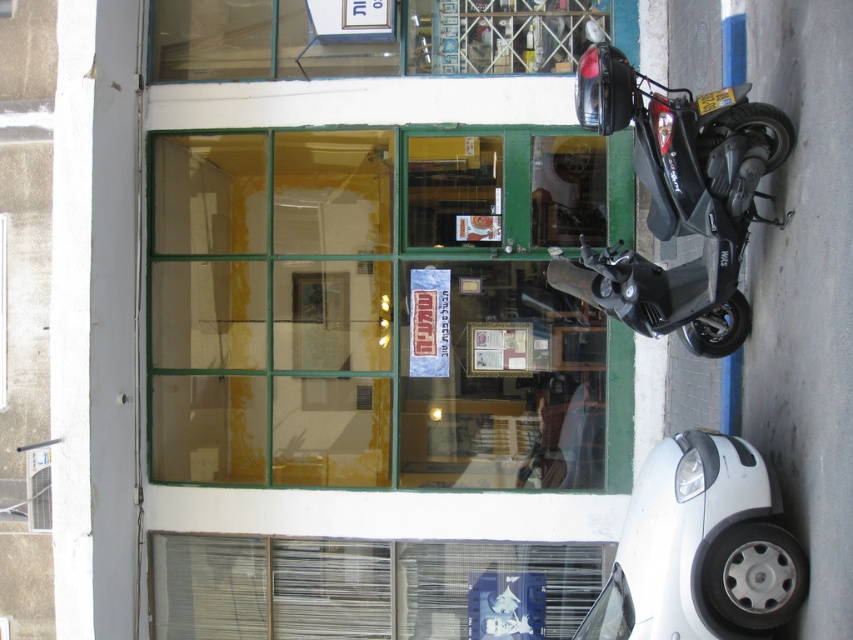
Can you confirm if matte black scooter at right is smaller than transparent glass window at upper center?

No, matte black scooter at right is not smaller than transparent glass window at upper center.

Is matte black scooter at right bigger than transparent glass window at upper center?

Yes.

Find the location of `matte black scooter at right`. matte black scooter at right is located at coordinates (677, 202).

Image resolution: width=853 pixels, height=640 pixels. I want to click on matte black scooter at right, so click(x=677, y=202).

Is point (669, 566) in front of point (198, 44)?

Yes, point (669, 566) is closer to viewer.

Does point (647, 518) come behind point (523, 4)?

That is False.

What do you see at coordinates (700, 548) in the screenshot? The image size is (853, 640). I see `white matte car at lower right` at bounding box center [700, 548].

Identify the location of white matte car at lower right. Image resolution: width=853 pixels, height=640 pixels. (700, 548).

Who is more distant from viewer, [593,156] or [631,589]?

Positioned behind is point [593,156].

The height and width of the screenshot is (640, 853). Identify the location of green glass shop window at center. (367, 314).